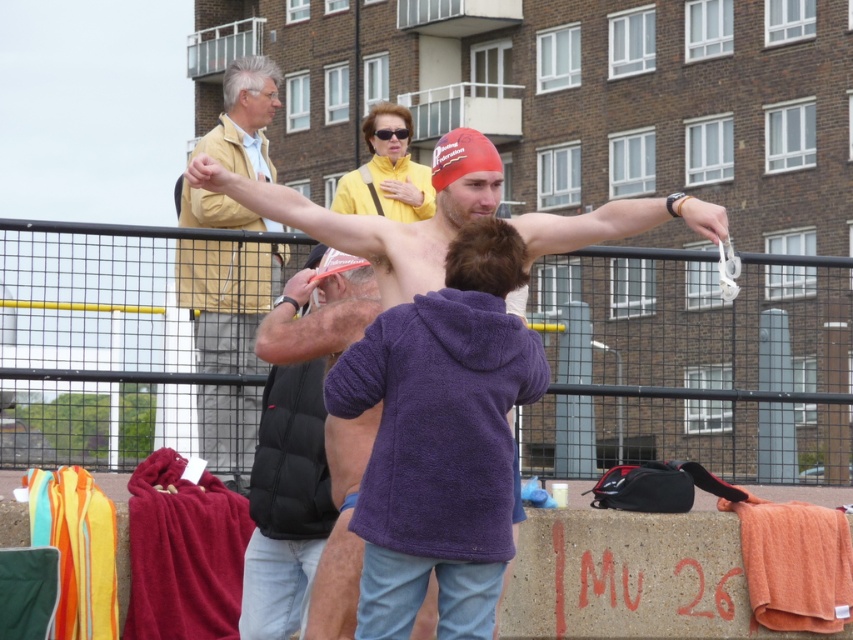
You are standing at the point with coordinates 0.5, 0.8 in the image. You want to walk towards the black mesh fence at lower center. In which direction should you move?

The black mesh fence at lower center is located at point (693, 364). Since you are at (682, 320), you should move slightly to the right and forward to reach it.

In the scene shown: You are standing at the black mesh fence at lower center and want to throw a ball to your friend who is at the concrete barrier with the letters

The distance between you and the concrete barrier with the letters

Based on the photo, you are a photographer trying to capture a photo of the shiny red swim cap at center without including the black mesh fence at lower center. Based on their positions, is this possible?

The black mesh fence at lower center is to the left of the shiny red swim cap at center, so if you position yourself to the right side of the scene, you can capture the swim cap without the fence in the frame.